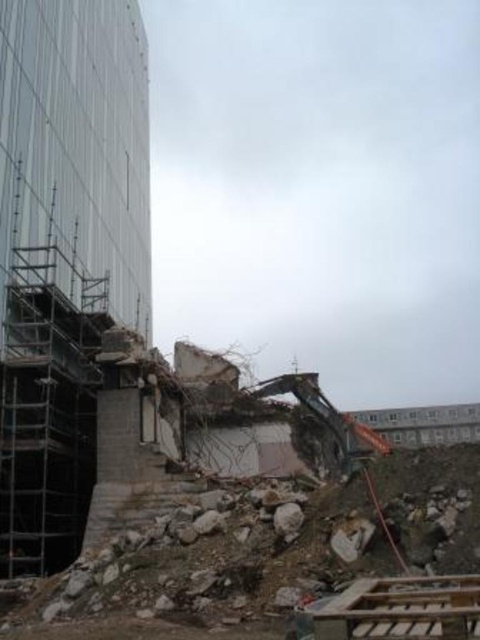
Question: Is rubble concrete at lower center below metallic gray excavator at center?

Choices:
 (A) yes
 (B) no

Answer: (B)

Question: Which point is closer to the camera taking this photo?

Choices:
 (A) [228, 516]
 (B) [303, 404]

Answer: (A)

Question: Which point is closer to the camera?

Choices:
 (A) (380, 465)
 (B) (305, 372)

Answer: (A)

Question: Does rubble concrete at lower center appear over metallic gray excavator at center?

Choices:
 (A) no
 (B) yes

Answer: (B)

Question: Is rubble concrete at lower center to the left of metallic gray excavator at center from the viewer's perspective?

Choices:
 (A) yes
 (B) no

Answer: (A)

Question: Among these points, which one is farthest from the camera?

Choices:
 (A) (420, 554)
 (B) (326, 424)

Answer: (B)